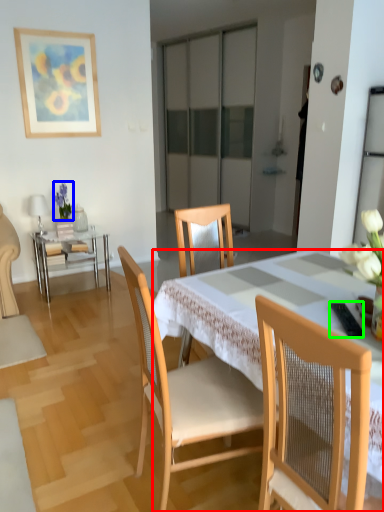
Question: Which object is positioned farthest from desk (highlighted by a red box)? Select from floral arrangement (highlighted by a blue box) and remote control (highlighted by a green box).

Choices:
 (A) floral arrangement
 (B) remote control

Answer: (A)